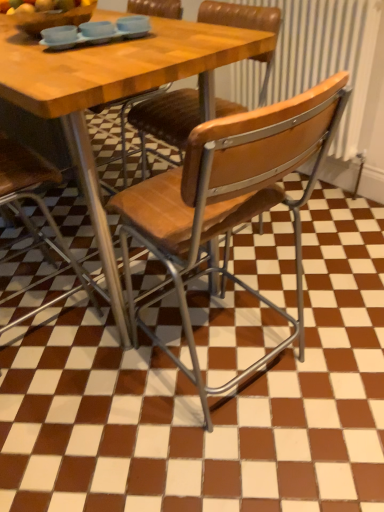
Question: In which direction should I rotate to look at wooden seat at center, positioned as the second chair in right-to-left order?

Choices:
 (A) left
 (B) right

Answer: (B)

Question: Is wooden seat at center, which is the 2th chair in left-to-right order, aimed at wooden seat at center, the third chair when ordered from left to right?

Choices:
 (A) yes
 (B) no

Answer: (B)

Question: From a real-world perspective, is wooden seat at center, which is the 2th chair in left-to-right order, over wooden seat at center, the third chair when ordered from left to right?

Choices:
 (A) no
 (B) yes

Answer: (B)

Question: From the image's perspective, is wooden seat at center, positioned as the second chair in right-to-left order, over wooden seat at center, positioned as the first chair in right-to-left order?

Choices:
 (A) yes
 (B) no

Answer: (A)

Question: Does wooden seat at center, positioned as the second chair in right-to-left order, appear on the right side of wooden seat at center, positioned as the first chair in right-to-left order?

Choices:
 (A) no
 (B) yes

Answer: (A)

Question: Is wooden seat at center, the third chair when ordered from left to right, located within wooden seat at center, positioned as the second chair in right-to-left order?

Choices:
 (A) no
 (B) yes

Answer: (A)

Question: Is wooden seat at center, positioned as the second chair in right-to-left order, beside wooden seat at center, the third chair when ordered from left to right?

Choices:
 (A) yes
 (B) no

Answer: (B)

Question: Does wooden seat at center, the third chair when ordered from left to right, have a lesser height compared to matte blue tray at upper center?

Choices:
 (A) yes
 (B) no

Answer: (B)

Question: Would you consider wooden seat at center, the third chair when ordered from left to right, to be distant from matte blue tray at upper center?

Choices:
 (A) yes
 (B) no

Answer: (B)

Question: Is wooden seat at center, positioned as the first chair in right-to-left order, next to matte blue tray at upper center and touching it?

Choices:
 (A) yes
 (B) no

Answer: (B)

Question: Considering the relative sizes of wooden seat at center, the third chair when ordered from left to right, and matte blue tray at upper center in the image provided, is wooden seat at center, the third chair when ordered from left to right, wider than matte blue tray at upper center?

Choices:
 (A) no
 (B) yes

Answer: (B)

Question: Is wooden seat at center, the third chair when ordered from left to right, aimed at matte blue tray at upper center?

Choices:
 (A) yes
 (B) no

Answer: (A)

Question: From a real-world perspective, is wooden seat at center, the third chair when ordered from left to right, below matte blue tray at upper center?

Choices:
 (A) no
 (B) yes

Answer: (B)

Question: Does wooden seat at center, marked as the 3th chair in a right-to-left arrangement, come behind wooden seat at center, positioned as the second chair in right-to-left order?

Choices:
 (A) no
 (B) yes

Answer: (A)